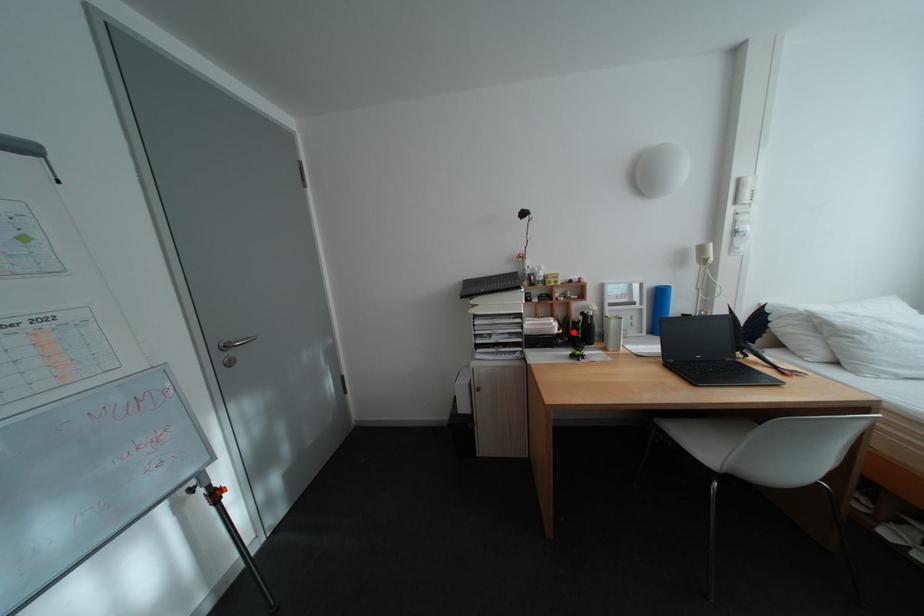
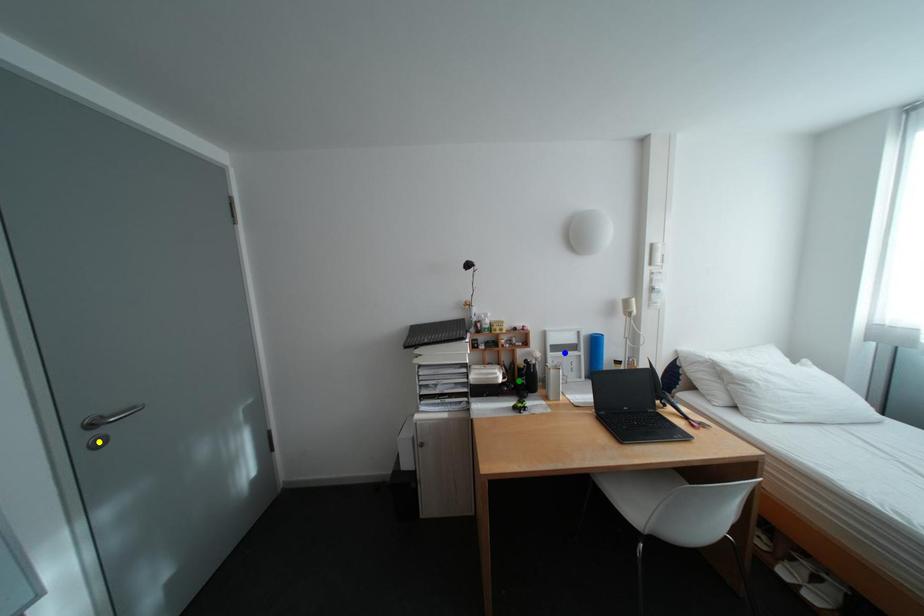
Question: I am providing you with two images of the same scene from different viewpoints. A red point is marked on the first image. You are given multiple points on the second image. Which spot in image 2 lines up with the point in image 1?

Choices:
 (A) yellow point
 (B) blue point
 (C) green point

Answer: (C)